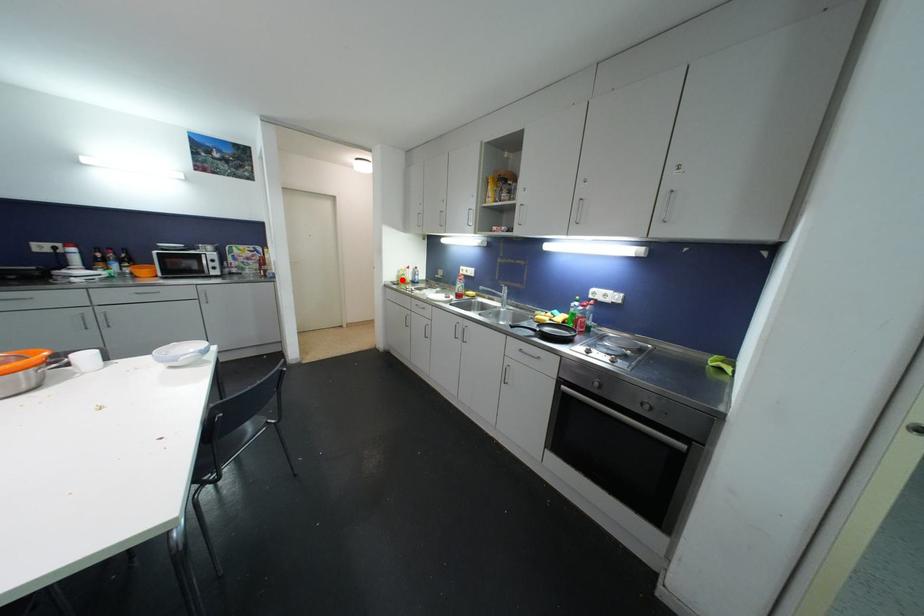
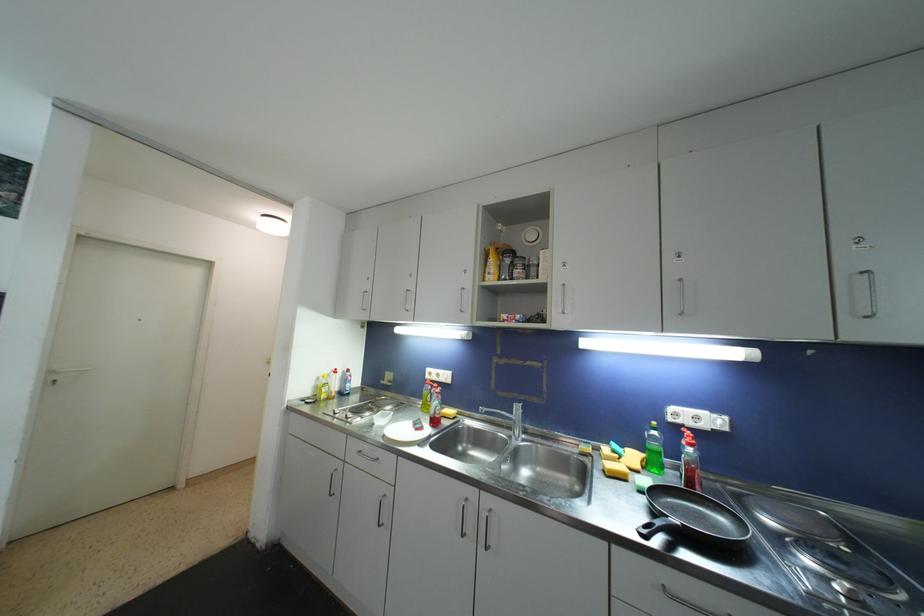
In the second image, find the point that corresponds to the highlighted location in the first image.

(321, 391)